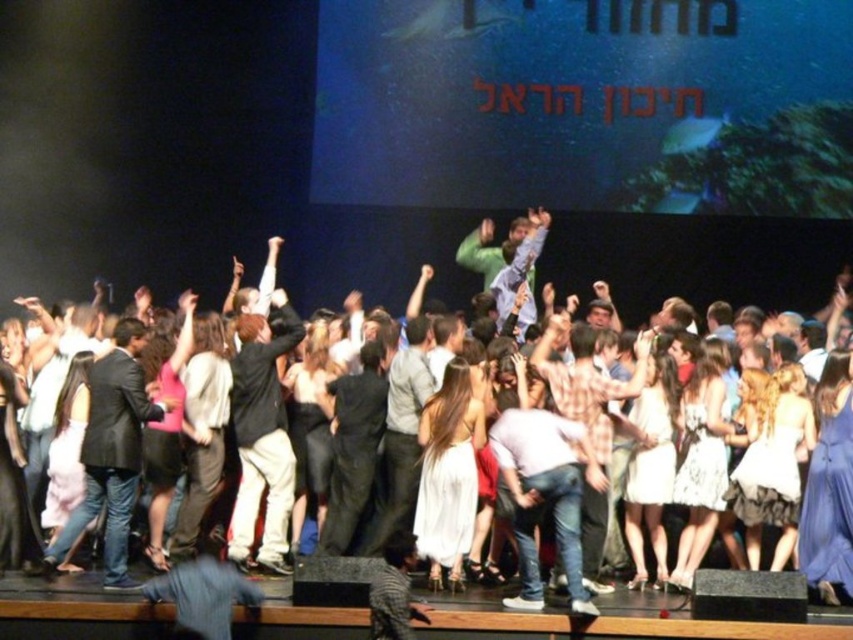
Is dark gray suit at center taller than plaid fabric shirt at center?

Incorrect, dark gray suit at center's height is not larger of plaid fabric shirt at center's.

This screenshot has height=640, width=853. Find the location of `dark gray suit at center`. dark gray suit at center is located at coordinates (112, 451).

Is black matte jacket at center positioned behind light brown leather jacket at center?

That is True.

Which is below, black matte jacket at center or light brown leather jacket at center?

light brown leather jacket at center is lower down.

Identify the location of black matte jacket at center. (262, 436).

This screenshot has height=640, width=853. Find the location of `black matte jacket at center`. black matte jacket at center is located at coordinates (262, 436).

Between dark gray suit at center and light brown leather jacket at center, which one is positioned higher?

light brown leather jacket at center is above.

Between dark gray suit at center and light brown leather jacket at center, which one is positioned lower?

dark gray suit at center is below.

Identify the location of dark gray suit at center. This screenshot has width=853, height=640. coord(112,451).